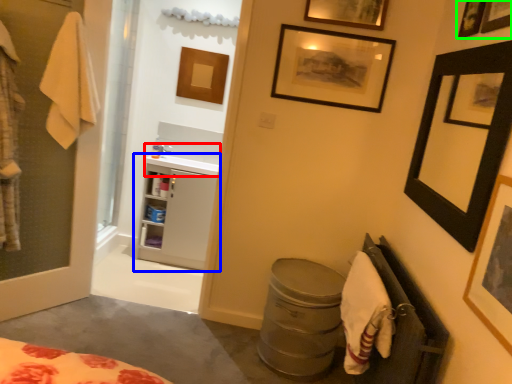
Question: Estimate the real-world distances between objects in this image. Which object is farther from sink (highlighted by a red box), bathroom cabinet (highlighted by a blue box) or picture frame (highlighted by a green box)?

Choices:
 (A) bathroom cabinet
 (B) picture frame

Answer: (B)